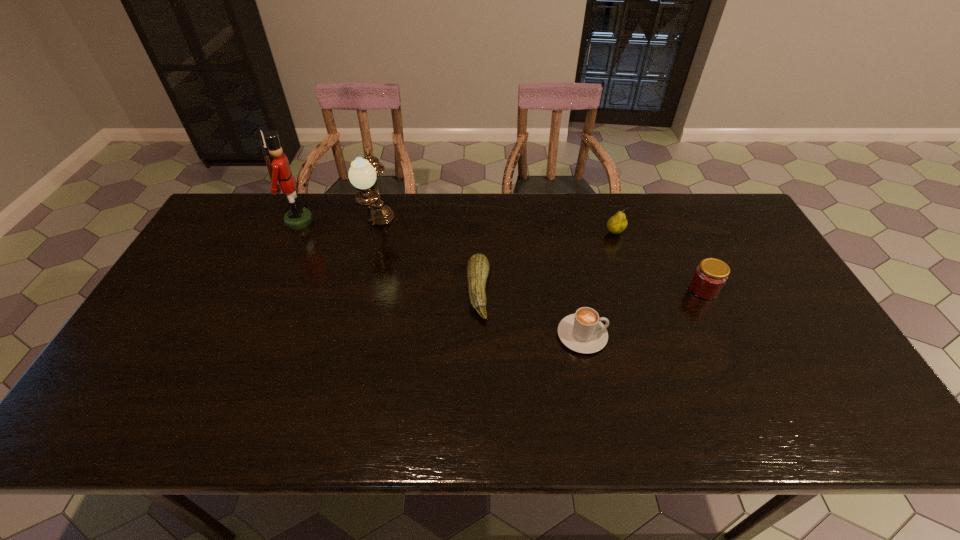
The height and width of the screenshot is (540, 960). I want to click on free space located 0.280m on the front-facing side of the leftmost object, so 397,221.

Locate an element on the screen. The width and height of the screenshot is (960, 540). free space located 0.270m on the left of the second object from left to right is located at coordinates (282, 226).

The height and width of the screenshot is (540, 960). I want to click on free space located 0.160m on the front of the pear, so click(x=629, y=275).

I want to click on free point located on the back of the jam, so click(671, 220).

Find the location of `free space located 0.380m to the right of the fifth tallest object`. free space located 0.380m to the right of the fifth tallest object is located at coordinates (754, 335).

I want to click on free space located at the stem end of the zucchini, so click(x=525, y=292).

Locate an element on the screen. This screenshot has width=960, height=540. nutcracker located at the far edge is located at coordinates (297, 217).

Find the location of `oil lamp present at the far edge`. oil lamp present at the far edge is located at coordinates pyautogui.click(x=362, y=174).

Where is `pear at the far edge`? The height and width of the screenshot is (540, 960). pear at the far edge is located at coordinates (616, 224).

The height and width of the screenshot is (540, 960). In the image, there is a desktop. What are the coordinates of `vacant space at the far edge` in the screenshot? It's located at (350, 195).